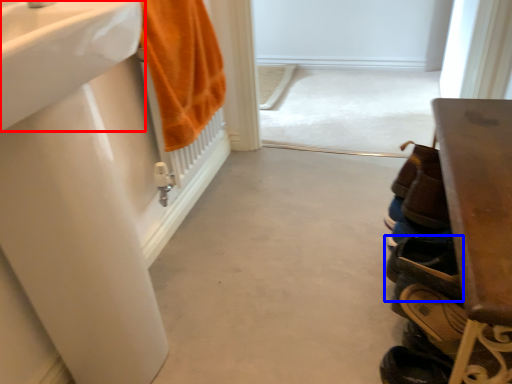
Question: Among these objects, which one is farthest to the camera, sink (highlighted by a red box) or footwear (highlighted by a blue box)?

Choices:
 (A) sink
 (B) footwear

Answer: (B)